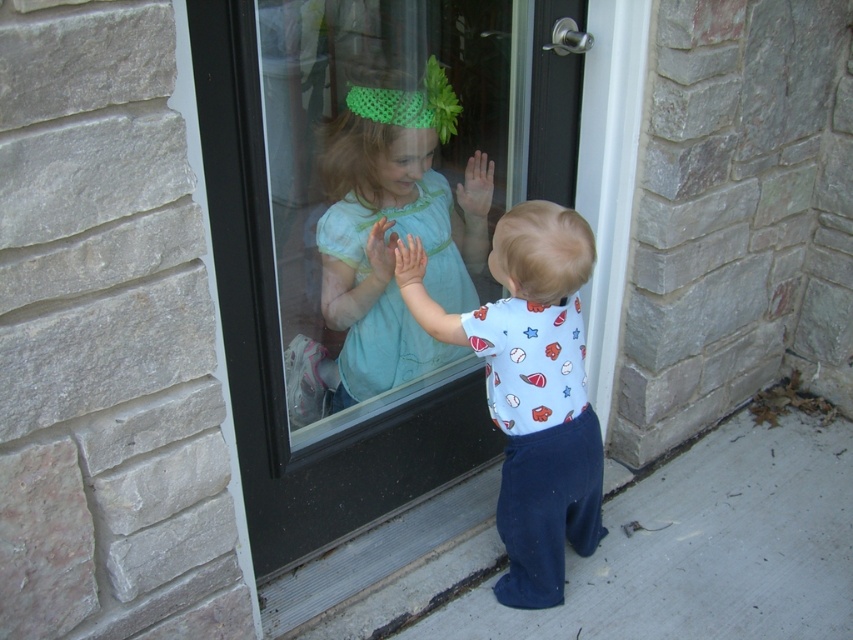
Question: Does clear glass door at center appear on the left side of light blue fabric dress at center?

Choices:
 (A) no
 (B) yes

Answer: (B)

Question: Is clear glass door at center to the left of light blue cotton onesie at center from the viewer's perspective?

Choices:
 (A) no
 (B) yes

Answer: (B)

Question: Which point is farther to the camera?

Choices:
 (A) coord(502,272)
 (B) coord(462,202)
 (C) coord(308,428)

Answer: (B)

Question: Does clear glass door at center have a larger size compared to light blue cotton onesie at center?

Choices:
 (A) yes
 (B) no

Answer: (A)

Question: Considering the real-world distances, which object is farthest from the light blue fabric dress at center?

Choices:
 (A) light blue cotton onesie at center
 (B) clear glass door at center

Answer: (A)

Question: Which object is the farthest from the light blue cotton onesie at center?

Choices:
 (A) light blue fabric dress at center
 (B) clear glass door at center

Answer: (B)